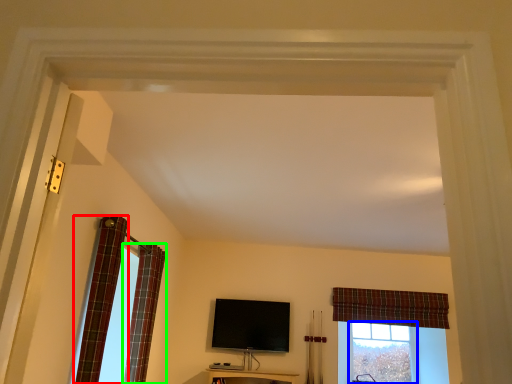
Question: Considering the real-world distances, which object is farthest from curtain (highlighted by a red box)? bay window (highlighted by a blue box) or curtain (highlighted by a green box)?

Choices:
 (A) bay window
 (B) curtain

Answer: (A)